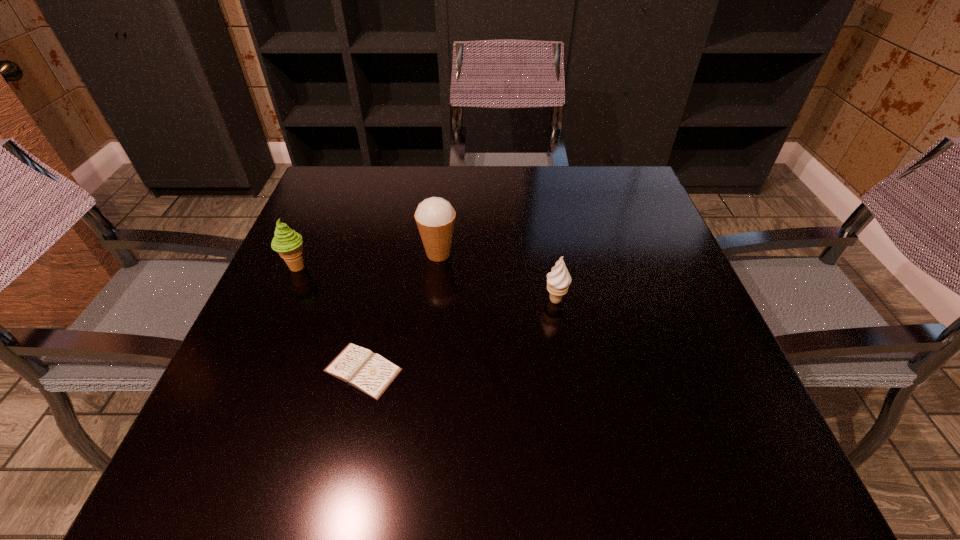
Locate an element on the screen. The height and width of the screenshot is (540, 960). object present at the left edge is located at coordinates (288, 243).

Identify the location of vacant region at the far edge. The image size is (960, 540). (470, 187).

Locate an element on the screen. This screenshot has height=540, width=960. vacant space at the near edge of the desktop is located at coordinates (660, 490).

This screenshot has width=960, height=540. In the image, there is a desktop. Find the location of `vacant area at the right edge`. vacant area at the right edge is located at coordinates (678, 396).

This screenshot has width=960, height=540. In the image, there is a desktop. In order to click on blank space at the far right corner in this screenshot , I will do `click(636, 184)`.

This screenshot has height=540, width=960. Find the location of `vacant space at the near right corner of the desktop`. vacant space at the near right corner of the desktop is located at coordinates (720, 466).

I want to click on vacant area between the nearest icecream and the diary, so click(459, 335).

The height and width of the screenshot is (540, 960). I want to click on free area in between the diary and the rightmost icecream, so click(459, 335).

Locate an element on the screen. This screenshot has width=960, height=540. vacant region between the rightmost object and the shortest object is located at coordinates coord(459,335).

This screenshot has width=960, height=540. In order to click on vacant area between the second icecream from left to right and the rightmost icecream in this screenshot , I will do `click(497, 277)`.